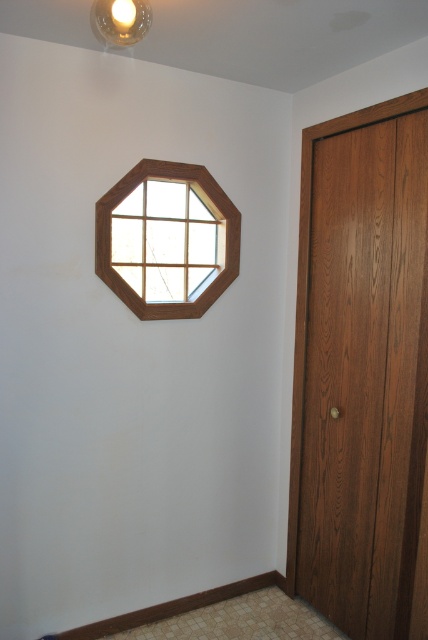
Does wooden-framed octagonal window at upper center appear under matte white bulb at upper center?

Correct, wooden-framed octagonal window at upper center is located below matte white bulb at upper center.

Can you confirm if wooden-framed octagonal window at upper center is thinner than matte white bulb at upper center?

Yes.

The height and width of the screenshot is (640, 428). I want to click on wooden-framed octagonal window at upper center, so click(x=166, y=240).

Does wooden door at right appear on the right side of matte white bulb at upper center?

Indeed, wooden door at right is positioned on the right side of matte white bulb at upper center.

Between wooden door at right and matte white bulb at upper center, which one is positioned lower?

wooden door at right is below.

Image resolution: width=428 pixels, height=640 pixels. In order to click on wooden door at right in this screenshot , I will do point(360,369).

Between wooden door at right and wooden-framed octagonal window at upper center, which one is positioned lower?

wooden door at right

Which of these two, wooden door at right or wooden-framed octagonal window at upper center, stands taller?

wooden door at right is taller.

Does point (391, 275) come farther from viewer compared to point (178, 168)?

No, (391, 275) is closer to viewer.

The width and height of the screenshot is (428, 640). What are the coordinates of `wooden door at right` in the screenshot? It's located at (360, 369).